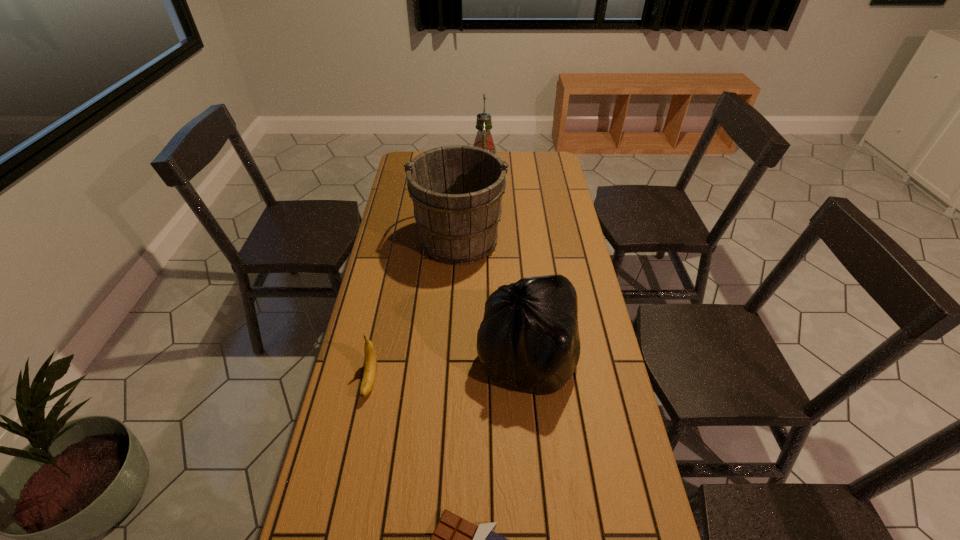
Where is `oil lamp`? oil lamp is located at coordinates (484, 140).

This screenshot has height=540, width=960. Find the location of `the second farthest object`. the second farthest object is located at coordinates (456, 190).

Where is `plastic bag`? plastic bag is located at coordinates (529, 338).

The image size is (960, 540). Find the location of `the leftmost object`. the leftmost object is located at coordinates (370, 367).

At what (x,y) coordinates should I click in order to perform the action: click on banana. Please return your answer as a coordinate pair (x, y). Looking at the image, I should click on (370, 367).

Where is `free space located 0.300m on the right of the oil lamp`? The width and height of the screenshot is (960, 540). free space located 0.300m on the right of the oil lamp is located at coordinates (564, 177).

Locate an element on the screen. vacant space located on the handle side of the bucket is located at coordinates (463, 177).

Where is `free space located 0.070m on the handle side of the bucket`? free space located 0.070m on the handle side of the bucket is located at coordinates (461, 201).

Find the location of a particular element. free spot located 0.370m on the handle side of the bucket is located at coordinates click(463, 165).

Locate an element on the screen. The height and width of the screenshot is (540, 960). vacant area situated 0.070m on the front of the plastic bag is located at coordinates (534, 429).